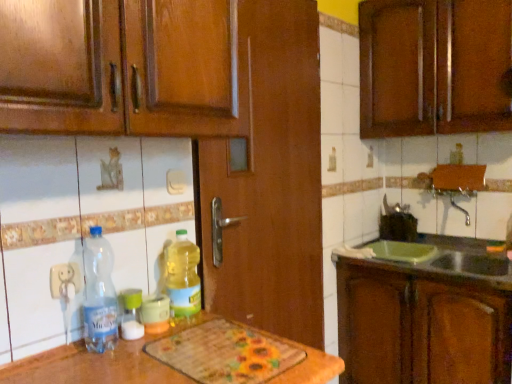
Question: Is point (138, 336) closer or farther from the camera than point (419, 355)?

Choices:
 (A) closer
 (B) farther

Answer: (A)

Question: From a real-world perspective, relative to brown wood cabinet at right, the second cabinetry viewed from the top, is translucent plastic bottle at center, the second bottle from the left, vertically above or below?

Choices:
 (A) above
 (B) below

Answer: (A)

Question: Which of these objects is positioned farthest from the green plastic sink at lower right?

Choices:
 (A) brown wood cabinet at right, marked as the first cabinetry in a bottom-to-top arrangement
 (B) clear plastic bottle at lower left, which appears as the third bottle when viewed from the right
 (C) translucent plastic bottle at center, the second bottle from the left
 (D) translucent plastic bottle at center, which ranks as the third bottle in left-to-right order
 (E) wooden cabinet at upper right, placed as the 2th cabinetry when sorted from bottom to top

Answer: (B)

Question: Based on their relative distances, which object is farther from the clear plastic bottle at lower left, which appears as the third bottle when viewed from the right?

Choices:
 (A) brown wood cabinet at right, the second cabinetry viewed from the top
 (B) translucent plastic bottle at center, positioned as the second bottle in right-to-left order
 (C) green plastic sink at lower right
 (D) wooden cabinet at upper right, which is the 1th cabinetry in top-to-bottom order
 (E) translucent plastic bottle at center, which is the 1th bottle from right to left

Answer: (D)